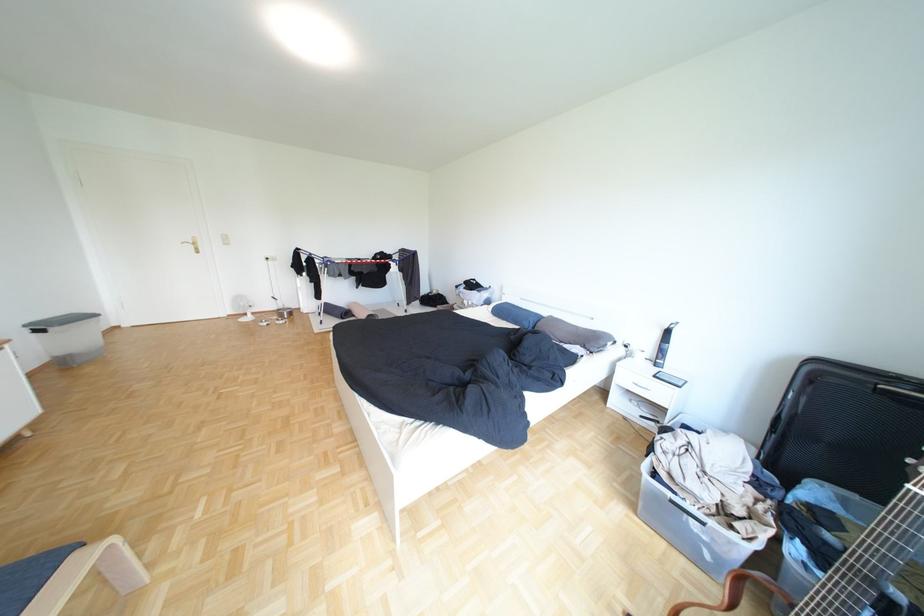
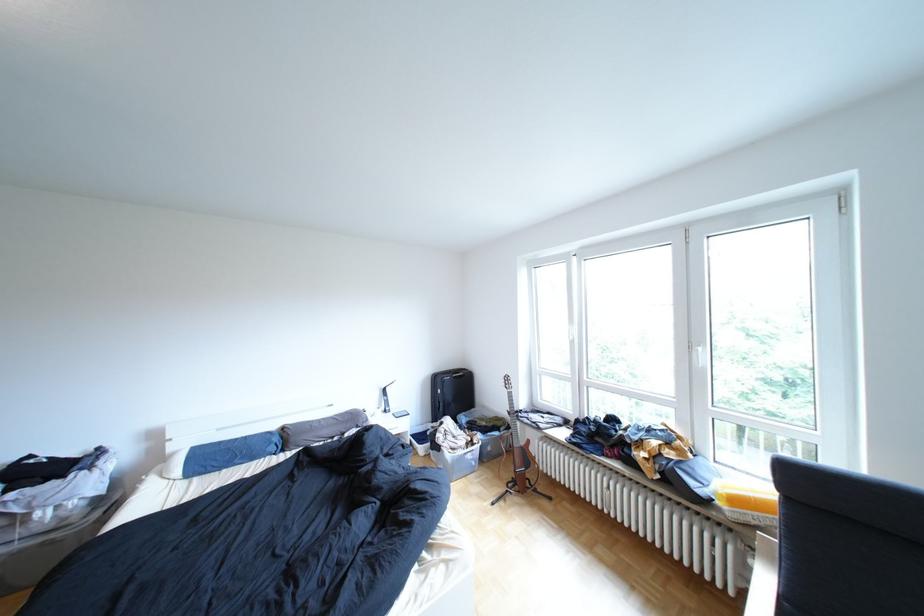
Find the pixel in the second image that matches pixel 560 313 in the first image.

(289, 427)